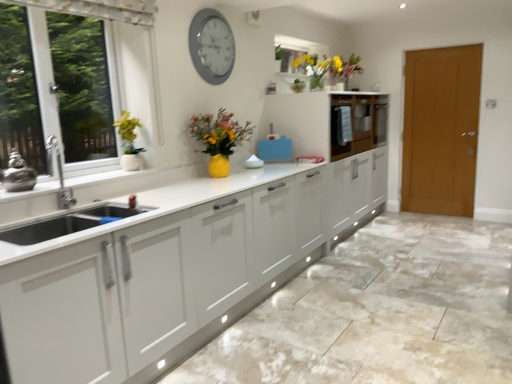
Question: Visually, is matte white cabinet at center, which is the 2th cabinetry in back-to-front order, positioned to the left or to the right of white marble granite at lower center?

Choices:
 (A) left
 (B) right

Answer: (A)

Question: From the image's perspective, relative to white marble granite at lower center, is matte white cabinet at center, which is the 2th cabinetry in back-to-front order, above or below?

Choices:
 (A) below
 (B) above

Answer: (B)

Question: Which object is the farthest from the matte white cabinet at center, arranged as the second cabinetry when viewed from the front?

Choices:
 (A) silver metallic clock at upper center
 (B) yellow matte vase at upper center
 (C) matte white cabinet at center, marked as the first cabinetry in a front-to-back arrangement
 (D) white marble granite at lower center
 (E) brown wooden door at right

Answer: (D)

Question: Which object is the closest to the matte white cabinet at center, the 1th cabinetry positioned from the back?

Choices:
 (A) yellow matte vase at upper center
 (B) matte white cabinet at center, marked as the first cabinetry in a front-to-back arrangement
 (C) brown wooden door at right
 (D) white marble granite at lower center
 (E) silver metallic clock at upper center

Answer: (B)